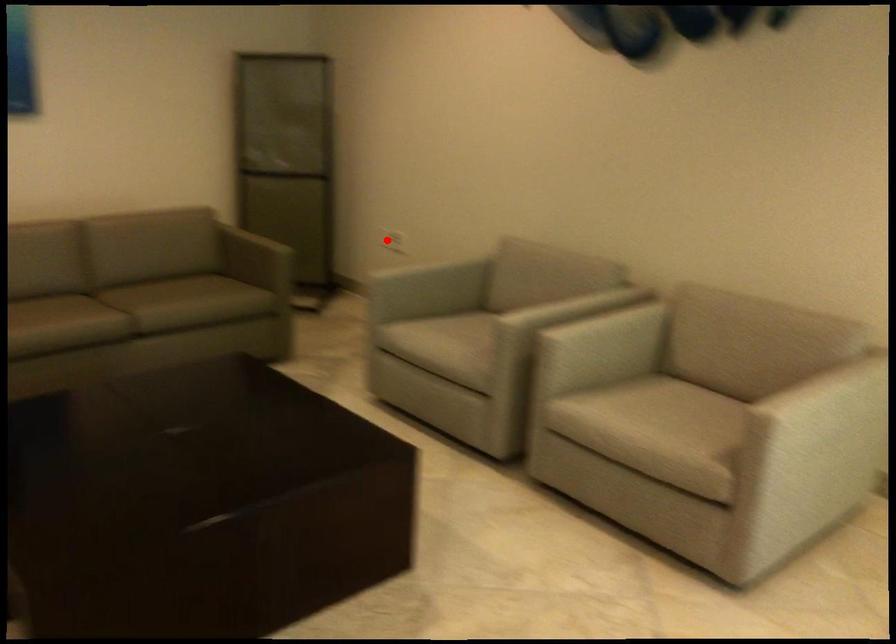
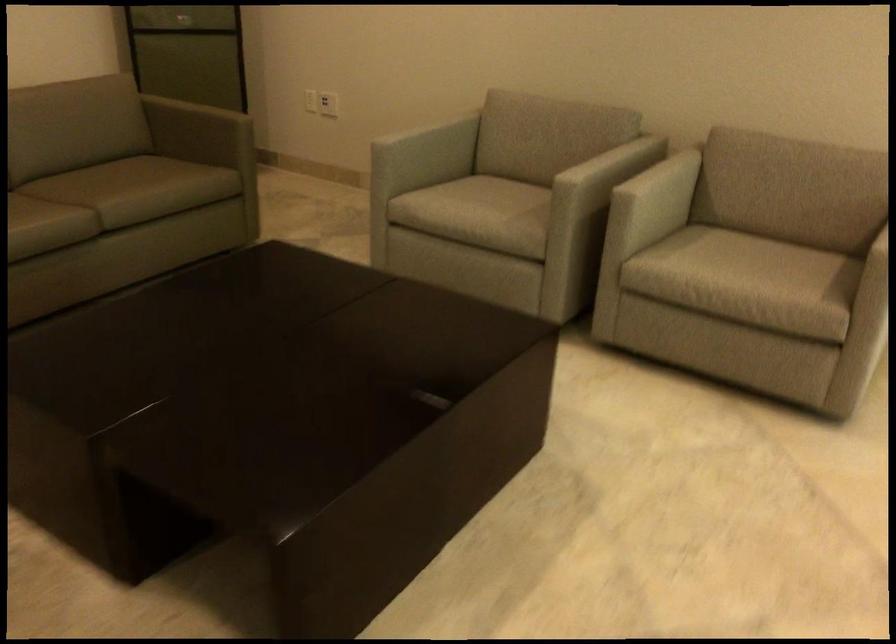
In the second image, find the point that corresponds to the highlighted location in the first image.

(328, 104)